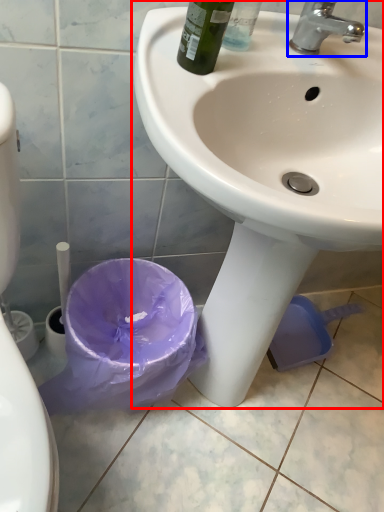
Question: Which object is closer to the camera taking this photo, sink (highlighted by a red box) or tap (highlighted by a blue box)?

Choices:
 (A) sink
 (B) tap

Answer: (A)